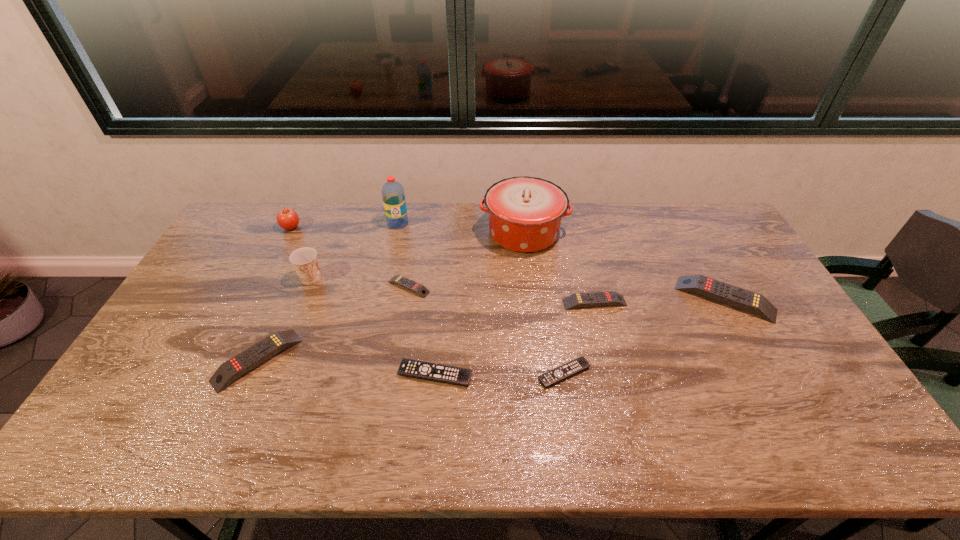
At what (x,y) coordinates should I click in order to perform the action: click on free space located 0.130m on the front of the seventh tallest object. Please return your answer as a coordinate pair (x, y). This screenshot has width=960, height=540. Looking at the image, I should click on (605, 345).

I want to click on free location located 0.400m on the left of the smallest yellow remote control, so click(x=260, y=287).

Where is `free point located 0.360m on the back of the left black remote control`? The image size is (960, 540). free point located 0.360m on the back of the left black remote control is located at coordinates (444, 271).

You are a GUI agent. You are given a task and a screenshot of the screen. Output one action in this format:
    pyautogui.click(x=<x>, y=<y>)
    Task: Click on the vacant space situated on the back of the right black remote control
    This screenshot has width=960, height=540.
    Given the screenshot: What is the action you would take?
    [x=548, y=275]

Where is `water bottle that is positioned at the far edge`? The height and width of the screenshot is (540, 960). water bottle that is positioned at the far edge is located at coordinates (393, 195).

Identify the location of casserole located in the far edge section of the desktop. The height and width of the screenshot is (540, 960). coord(525,213).

Locate an element on the screen. This screenshot has width=960, height=540. apple that is at the far edge is located at coordinates click(x=287, y=218).

Where is `object located at the right edge`? The width and height of the screenshot is (960, 540). object located at the right edge is located at coordinates (732, 295).

In the image, there is a desktop. Where is `free space at the far edge`? free space at the far edge is located at coordinates (478, 232).

In the image, there is a desktop. Where is `free space at the near edge`? This screenshot has width=960, height=540. free space at the near edge is located at coordinates (793, 454).